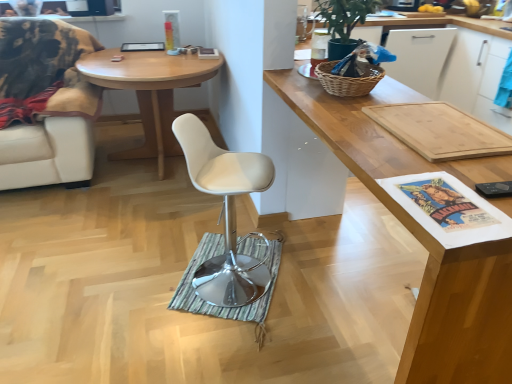
Where is `vacant area on the back side of white leather swivel chair at center`? The height and width of the screenshot is (384, 512). vacant area on the back side of white leather swivel chair at center is located at coordinates (238, 243).